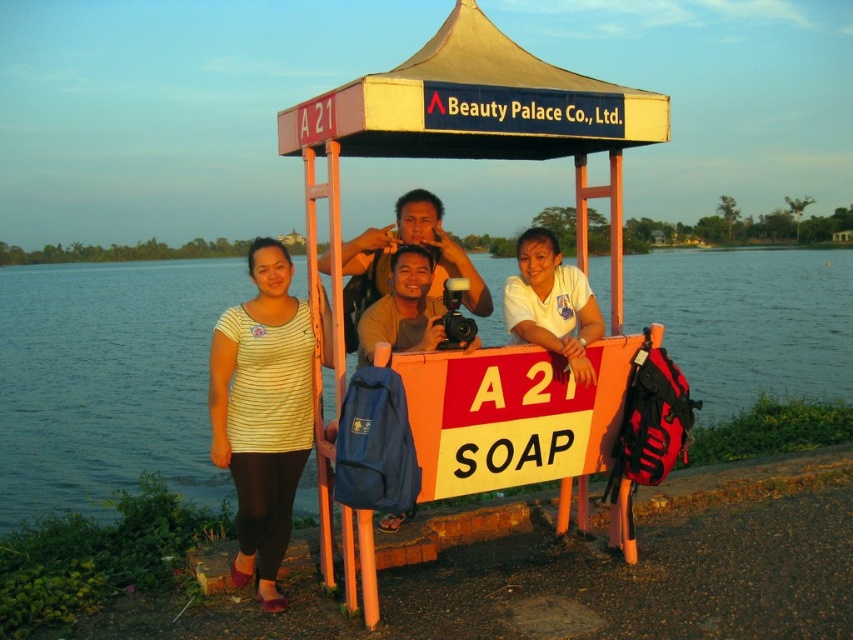
Is yellow fabric canopy at upper center smaller than white matte shirt at center?

No.

Image resolution: width=853 pixels, height=640 pixels. Describe the element at coordinates (474, 104) in the screenshot. I see `yellow fabric canopy at upper center` at that location.

The image size is (853, 640). Find the location of `yellow fabric canopy at upper center`. yellow fabric canopy at upper center is located at coordinates [474, 104].

I want to click on white fabric gazebo at center, so click(486, 157).

Describe the element at coordinates (486, 157) in the screenshot. I see `white fabric gazebo at center` at that location.

Where is `white fabric gazebo at center`? The width and height of the screenshot is (853, 640). white fabric gazebo at center is located at coordinates [486, 157].

Which is more to the right, striped fabric shirt at left or white matte shirt at center?

white matte shirt at center

Is striped fabric shirt at left wider than white matte shirt at center?

Incorrect, striped fabric shirt at left's width does not surpass white matte shirt at center's.

Does point (265, 243) come in front of point (519, 236)?

Yes, it is.

This screenshot has width=853, height=640. I want to click on striped fabric shirt at left, so click(262, 413).